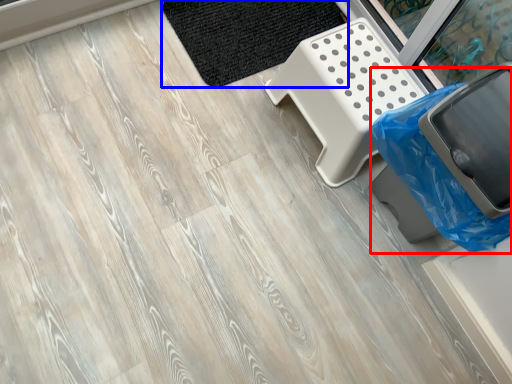
Question: Among these objects, which one is farthest to the camera, garbage (highlighted by a red box) or mat (highlighted by a blue box)?

Choices:
 (A) garbage
 (B) mat

Answer: (B)